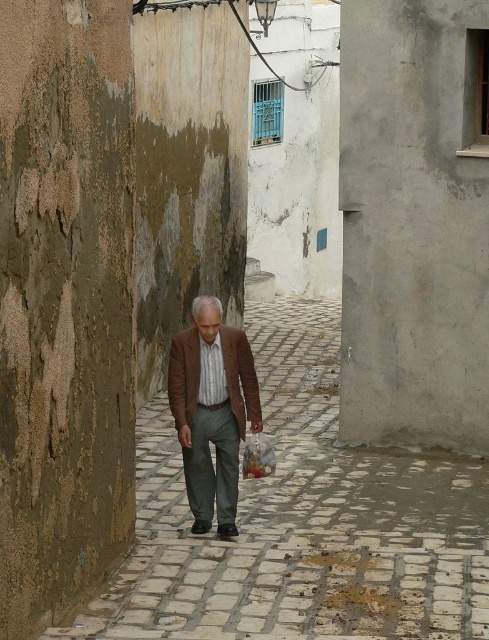
You are standing in the middle of the alleyway and notice a specific point marked at coordinates (x=302, y=522). According to the scene description, what object is located at this point?

The point at coordinates (x=302, y=522) indicates the white stone pavement at center.

You are standing in the alleyway and notice both the white stone pavement at center and the brown leather jacket at center. Which object is closer to the ground?

The white stone pavement at center is located below the brown leather jacket at center, so the white stone pavement at center is closer to the ground.

You are a delivery person in a narrow alleyway between two weathered walls. You see two jackets at the center of the alley. Which jacket is closer to the left wall? The jackets are the brown textured jacket at center and the brown leather jacket at center.

The brown textured jacket at center is positioned on the left side of the brown leather jacket at center, so it is closer to the left wall.